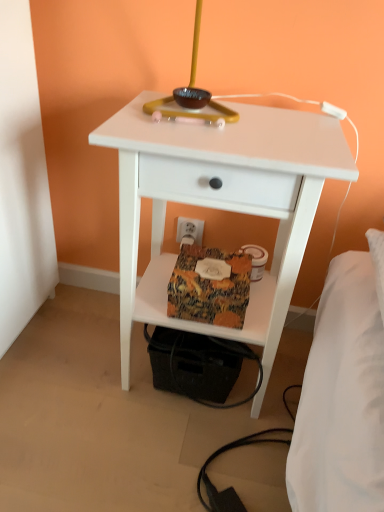
I want to click on white matte nightstand at center, so click(x=221, y=204).

What do you see at coordinates (209, 288) in the screenshot?
I see `textured fabric package at lower center` at bounding box center [209, 288].

Identify the location of matte yellow table lamp at upper center. The height and width of the screenshot is (512, 384). (192, 96).

This screenshot has width=384, height=512. I want to click on white matte nightstand at center, so click(221, 204).

Considering the sizes of textured fabric package at lower center and matte yellow table lamp at upper center in the image, is textured fabric package at lower center bigger or smaller than matte yellow table lamp at upper center?

textured fabric package at lower center is smaller than matte yellow table lamp at upper center.

From the image's perspective, is textured fabric package at lower center on top of matte yellow table lamp at upper center?

No.

Is textured fabric package at lower center closer to the viewer compared to matte yellow table lamp at upper center?

No, textured fabric package at lower center is further to the viewer.

How distant is textured fabric package at lower center from matte yellow table lamp at upper center?

textured fabric package at lower center and matte yellow table lamp at upper center are 14.74 inches apart from each other.

Is white plastic electric outlet at lower center inside or outside of white matte nightstand at center?

white plastic electric outlet at lower center cannot be found inside white matte nightstand at center.

In the scene shown: Can you confirm if white plastic electric outlet at lower center is thinner than white matte nightstand at center?

Yes.

Locate an element on the screen. electric outlet that is behind the white matte nightstand at center is located at coordinates (195, 230).

Would you say matte yellow table lamp at upper center is to the left or to the right of white plastic electric outlet at lower center in the picture?

matte yellow table lamp at upper center is to the right of white plastic electric outlet at lower center.

Does matte yellow table lamp at upper center have a larger size compared to white plastic electric outlet at lower center?

Indeed, matte yellow table lamp at upper center has a larger size compared to white plastic electric outlet at lower center.

From the image's perspective, which object appears higher, matte yellow table lamp at upper center or white plastic electric outlet at lower center?

matte yellow table lamp at upper center appears higher in the image.

Is matte yellow table lamp at upper center oriented towards white plastic electric outlet at lower center?

No, matte yellow table lamp at upper center is not facing towards white plastic electric outlet at lower center.

Is the surface of white matte nightstand at center in direct contact with textured fabric package at lower center?

white matte nightstand at center and textured fabric package at lower center are clearly separated.

From a real-world perspective, which object stands above the other?

From a 3D spatial view, white matte nightstand at center is above.

Is white matte nightstand at center turned away from textured fabric package at lower center?

Yes, white matte nightstand at center is facing away from textured fabric package at lower center.

Identify the location of nightstand located above the textured fabric package at lower center (from the image's perspective). This screenshot has width=384, height=512. (221, 204).

Is white plastic electric outlet at lower center at the right side of textured fabric package at lower center?

No.

Is white plastic electric outlet at lower center in contact with textured fabric package at lower center?

No, white plastic electric outlet at lower center is not in contact with textured fabric package at lower center.

Looking at the image, does white plastic electric outlet at lower center seem bigger or smaller compared to textured fabric package at lower center?

Considering their sizes, white plastic electric outlet at lower center takes up less space than textured fabric package at lower center.

Is white plastic electric outlet at lower center taller or shorter than textured fabric package at lower center?

Clearly, white plastic electric outlet at lower center is shorter compared to textured fabric package at lower center.

Can you see textured fabric package at lower center touching white matte nightstand at center?

No, textured fabric package at lower center is not next to white matte nightstand at center.

From the picture: Which of these two, textured fabric package at lower center or white matte nightstand at center, stands taller?

With more height is white matte nightstand at center.

From a real-world perspective, does textured fabric package at lower center sit lower than white matte nightstand at center?

Yes, from a real-world perspective, textured fabric package at lower center is under white matte nightstand at center.

Based on the photo, which object is further away from the camera taking this photo, textured fabric package at lower center or white matte nightstand at center?

textured fabric package at lower center is further away from the camera.

Considering the relative positions of textured fabric package at lower center and white plastic electric outlet at lower center in the image provided, is textured fabric package at lower center to the left of white plastic electric outlet at lower center from the viewer's perspective?

In fact, textured fabric package at lower center is to the right of white plastic electric outlet at lower center.

From a real-world perspective, is textured fabric package at lower center above or below white plastic electric outlet at lower center?

textured fabric package at lower center is above white plastic electric outlet at lower center.

Considering the relative positions of textured fabric package at lower center and white plastic electric outlet at lower center in the image provided, is textured fabric package at lower center in front of white plastic electric outlet at lower center?

Yes, textured fabric package at lower center is closer to the camera.

Where is `table lamp on the left of the textured fabric package at lower center`? This screenshot has height=512, width=384. table lamp on the left of the textured fabric package at lower center is located at coordinates (192, 96).

The height and width of the screenshot is (512, 384). In order to click on nightstand on the right of white plastic electric outlet at lower center in this screenshot , I will do `click(221, 204)`.

Looking at the image, which one is located further to textured fabric package at lower center, matte yellow table lamp at upper center or white matte nightstand at center?

matte yellow table lamp at upper center.

Estimate the real-world distances between objects in this image. Which object is closer to matte yellow table lamp at upper center, white plastic electric outlet at lower center or white matte nightstand at center?

The object closer to matte yellow table lamp at upper center is white matte nightstand at center.

Which object lies further to the anchor point white matte nightstand at center, white plastic electric outlet at lower center or textured fabric package at lower center?

Based on the image, white plastic electric outlet at lower center appears to be further to white matte nightstand at center.

Estimate the real-world distances between objects in this image. Which object is further from white matte nightstand at center, white plastic electric outlet at lower center or matte yellow table lamp at upper center?

white plastic electric outlet at lower center lies further to white matte nightstand at center than the other object.

Estimate the real-world distances between objects in this image. Which object is further from white plastic electric outlet at lower center, white matte nightstand at center or matte yellow table lamp at upper center?

matte yellow table lamp at upper center.

From the image, which object appears to be nearer to white plastic electric outlet at lower center, textured fabric package at lower center or matte yellow table lamp at upper center?

textured fabric package at lower center.

Based on their spatial positions, is white matte nightstand at center or white plastic electric outlet at lower center closer to textured fabric package at lower center?

white matte nightstand at center is closer to textured fabric package at lower center.

Estimate the real-world distances between objects in this image. Which object is closer to matte yellow table lamp at upper center, white plastic electric outlet at lower center or textured fabric package at lower center?

textured fabric package at lower center is closer to matte yellow table lamp at upper center.

In order to click on nightstand between matte yellow table lamp at upper center and textured fabric package at lower center in the vertical direction in this screenshot , I will do `click(221, 204)`.

You are a GUI agent. You are given a task and a screenshot of the screen. Output one action in this format:
    pyautogui.click(x=<x>, y=<y>)
    Task: Click on the package between matte yellow table lamp at upper center and white plastic electric outlet at lower center along the z-axis
    This screenshot has width=384, height=512.
    Given the screenshot: What is the action you would take?
    pyautogui.click(x=209, y=288)

You are a GUI agent. You are given a task and a screenshot of the screen. Output one action in this format:
    pyautogui.click(x=<x>, y=<y>)
    Task: Click on the nightstand between matte yellow table lamp at upper center and white plastic electric outlet at lower center in the front-back direction
    
    Given the screenshot: What is the action you would take?
    pyautogui.click(x=221, y=204)

Find the location of a particular element. The image size is (384, 512). package between white matte nightstand at center and white plastic electric outlet at lower center in the front-back direction is located at coordinates (209, 288).